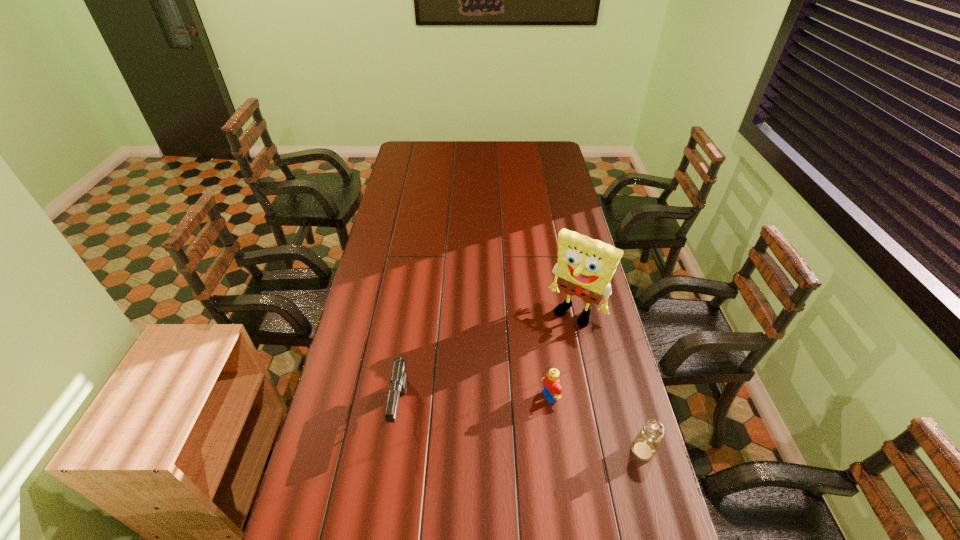
Identify the location of blank space at the far right corner of the desktop. The height and width of the screenshot is (540, 960). (542, 156).

Identify the location of vacant region between the saltshaker and the leftmost object. (522, 430).

Where is `vacant space that's between the sponge and the leftmost object`? vacant space that's between the sponge and the leftmost object is located at coordinates (489, 361).

Where is `free space that is in between the tallest object and the saltshaker`? free space that is in between the tallest object and the saltshaker is located at coordinates (610, 381).

Locate an element on the screen. This screenshot has height=540, width=960. free spot between the leftmost object and the third object from right to left is located at coordinates (475, 403).

Locate an element on the screen. The image size is (960, 540). free space between the second object from left to right and the saltshaker is located at coordinates (596, 423).

In order to click on free space that is in between the saltshaker and the leftmost object in this screenshot , I will do `click(522, 430)`.

The width and height of the screenshot is (960, 540). What are the coordinates of `vacant region between the Lego and the saltshaker` in the screenshot? It's located at pyautogui.click(x=596, y=423).

Where is `empty location between the saltshaker and the pistol`? The height and width of the screenshot is (540, 960). empty location between the saltshaker and the pistol is located at coordinates [522, 430].

Image resolution: width=960 pixels, height=540 pixels. I want to click on free point between the leftmost object and the second object from left to right, so click(x=475, y=403).